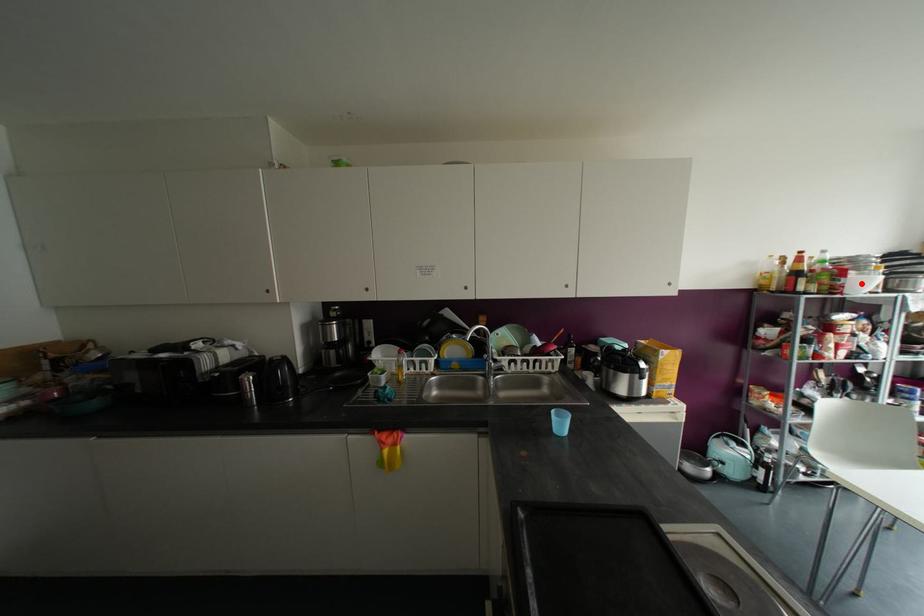
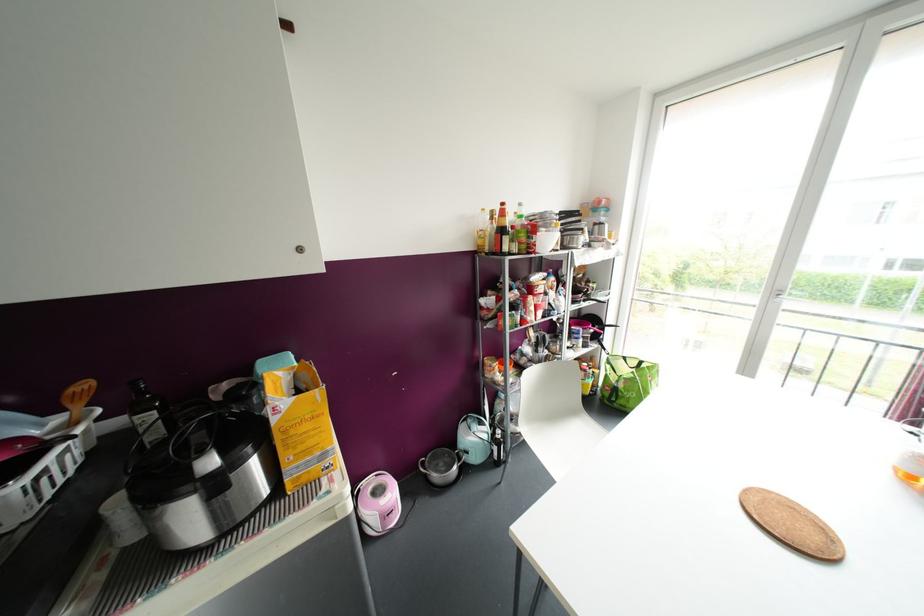
Find the pixel in the second image that matches the highlighted location in the first image.

(546, 241)